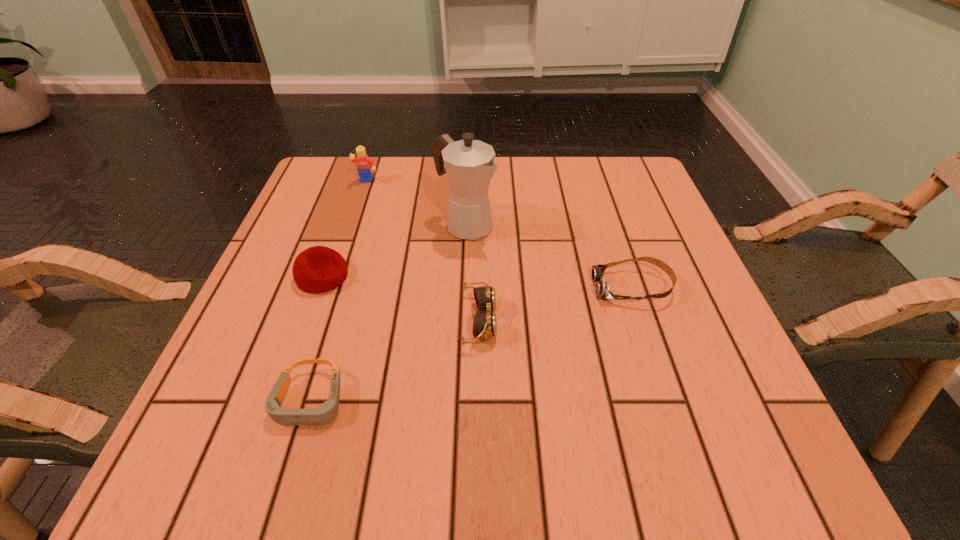
Where is `free location located on the face of the Lego`? The width and height of the screenshot is (960, 540). free location located on the face of the Lego is located at coordinates (353, 222).

This screenshot has height=540, width=960. Find the location of `vacant space located on the seat area of the beanbag`. vacant space located on the seat area of the beanbag is located at coordinates (452, 276).

Find the location of a particular element. This screenshot has width=960, height=540. vacant space situated through the lenses of the second goggles from right to left is located at coordinates (715, 321).

Locate an element on the screen. Image resolution: width=960 pixels, height=540 pixels. vacant space located 0.050m on the front-facing side of the rightmost goggles is located at coordinates point(568,287).

Locate an element on the screen. The width and height of the screenshot is (960, 540). vacant space located 0.360m on the front-facing side of the rightmost goggles is located at coordinates (410, 287).

This screenshot has width=960, height=540. I want to click on free region located on the front-facing side of the rightmost goggles, so click(436, 287).

In order to click on coffeepot located in the far edge section of the desktop in this screenshot , I will do `click(469, 164)`.

Find the location of `Lego that is at the far edge`. Lego that is at the far edge is located at coordinates (364, 163).

This screenshot has height=540, width=960. I want to click on object situated at the near edge, so click(x=326, y=412).

The height and width of the screenshot is (540, 960). In order to click on Lego that is at the left edge in this screenshot , I will do `click(364, 163)`.